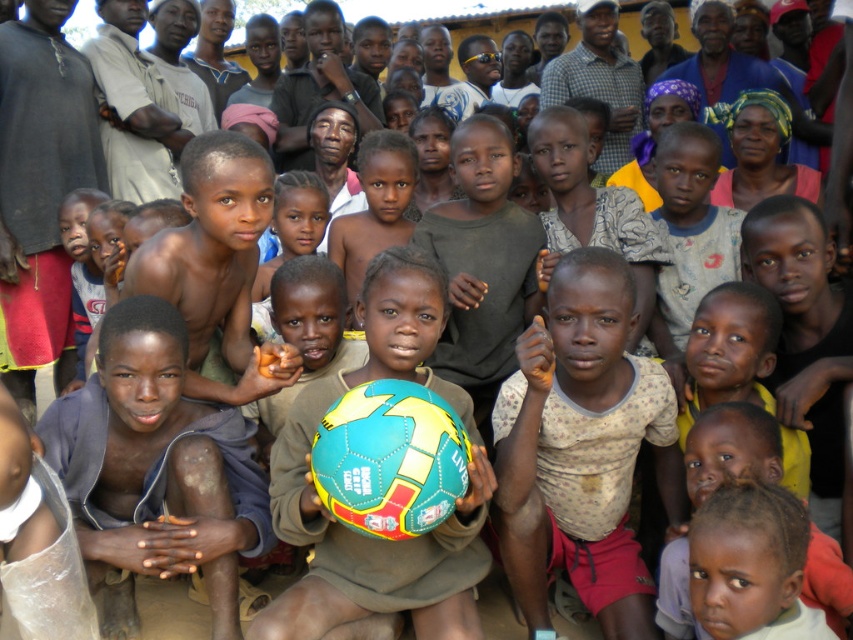
Question: Which point is closer to the camera taking this photo?

Choices:
 (A) (137, 449)
 (B) (416, 566)

Answer: (B)

Question: Which object is positioned closest to the printed cotton shirt at center?

Choices:
 (A) brown skin boy at center
 (B) multicolored rubber ball at center

Answer: (B)

Question: Which point is closer to the camera taking this photo?

Choices:
 (A) (535, 548)
 (B) (434, 307)
 (C) (152, 321)

Answer: (B)

Question: Can you confirm if printed cotton shirt at center is positioned to the right of multicolored rubber ball at center?

Choices:
 (A) yes
 (B) no

Answer: (A)

Question: Can you confirm if printed cotton shirt at center is positioned below brown skin boy at center?

Choices:
 (A) no
 (B) yes

Answer: (A)

Question: Considering the relative positions of brown skin boy at center and multicolored rubber ball at center in the image provided, where is brown skin boy at center located with respect to multicolored rubber ball at center?

Choices:
 (A) above
 (B) below

Answer: (B)